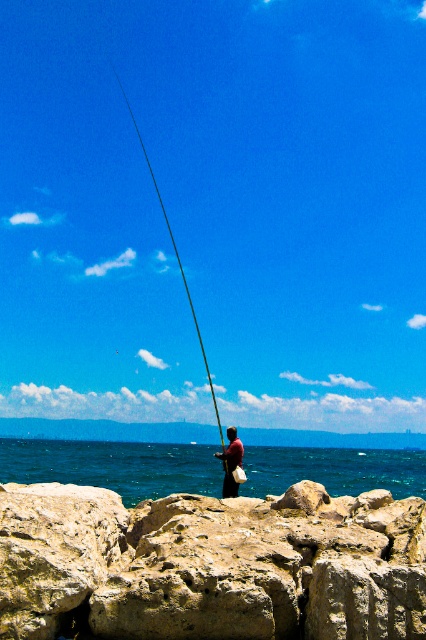
Who is higher up, rough textured rock at lower center or brown leather bag at center?

rough textured rock at lower center is higher up.

Between point (371, 602) and point (230, 492), which one is positioned in front?

Point (371, 602) is in front.

This screenshot has height=640, width=426. I want to click on rough textured rock at lower center, so click(x=210, y=564).

Where is `rough textured rock at lower center`? rough textured rock at lower center is located at coordinates tap(210, 564).

Measure the distance between point (x=192, y=312) and camera.

Point (x=192, y=312) and camera are 761.63 feet apart from each other.

Between point (126, 99) and point (233, 451), which one is positioned in front?

Positioned in front is point (233, 451).

What do you see at coordinates (173, 250) in the screenshot? The image size is (426, 640). I see `black rod fishing pole at center` at bounding box center [173, 250].

In order to click on black rod fishing pole at center in this screenshot , I will do `click(173, 250)`.

Can you confirm if rough textured rock at lower center is positioned above blue water at center?

Indeed, rough textured rock at lower center is positioned over blue water at center.

Who is more forward, (8, 593) or (39, 477)?

Point (8, 593) is more forward.

Does point (124, 509) come closer to viewer compared to point (22, 438)?

That is True.

Find the location of `rough textured rock at lower center`. rough textured rock at lower center is located at coordinates (210, 564).